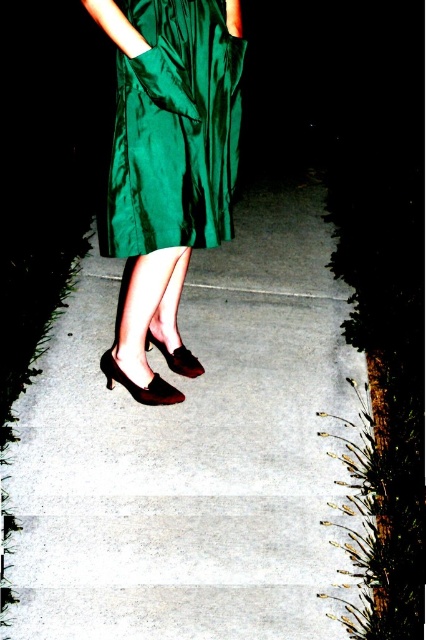
Can you confirm if shiny black leather high-heeled shoe at center is positioned to the left of suede-like brown sandal at center?

Yes, shiny black leather high-heeled shoe at center is to the left of suede-like brown sandal at center.

Which is more to the right, shiny black leather high-heeled shoe at center or suede-like brown sandal at center?

From the viewer's perspective, suede-like brown sandal at center appears more on the right side.

At what (x,y) coordinates should I click in order to perform the action: click on shiny black leather high-heeled shoe at center. Please return your answer as a coordinate pair (x, y). This screenshot has width=426, height=640. Looking at the image, I should click on (138, 385).

Between point (150, 419) and point (196, 364), which one is positioned in front?

Positioned in front is point (150, 419).

Can you confirm if smooth concrete pavement at center is positioned above suede-like brown sandal at center?

Yes, smooth concrete pavement at center is above suede-like brown sandal at center.

Is point (126, 416) positioned before point (178, 348)?

Yes, point (126, 416) is in front of point (178, 348).

Image resolution: width=426 pixels, height=640 pixels. In order to click on smooth concrete pavement at center in this screenshot , I will do `click(195, 452)`.

Is shiny green dress at center bigger than shiny black leather high-heeled shoe at center?

Indeed, shiny green dress at center has a larger size compared to shiny black leather high-heeled shoe at center.

Between shiny green dress at center and shiny black leather high-heeled shoe at center, which one is positioned lower?

shiny black leather high-heeled shoe at center is lower down.

I want to click on shiny green dress at center, so click(173, 131).